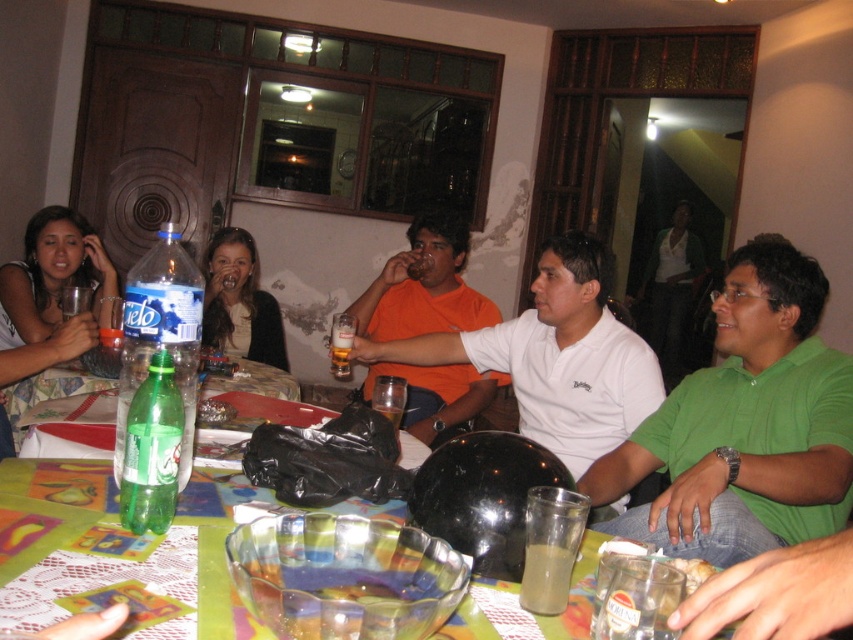
Question: Does orange matte shirt at center appear on the right side of matte black jacket at center?

Choices:
 (A) yes
 (B) no

Answer: (A)

Question: Is green plastic bottle at lower left smaller than translucent glass cup at lower center?

Choices:
 (A) no
 (B) yes

Answer: (A)

Question: Which of these objects is positioned farthest from the green plastic bottle at lower left?

Choices:
 (A) white shirt at center
 (B) translucent plastic cup at center

Answer: (A)

Question: Which point is farther from the camera taking this photo?

Choices:
 (A) (527, 556)
 (B) (207, 336)

Answer: (B)

Question: Does green cotton shirt at right appear over matte black jacket at center?

Choices:
 (A) no
 (B) yes

Answer: (A)

Question: Which point appears farthest from the camera in this image?

Choices:
 (A) (79, 280)
 (B) (426, 369)
 (C) (776, 570)
 (D) (469, 358)

Answer: (A)